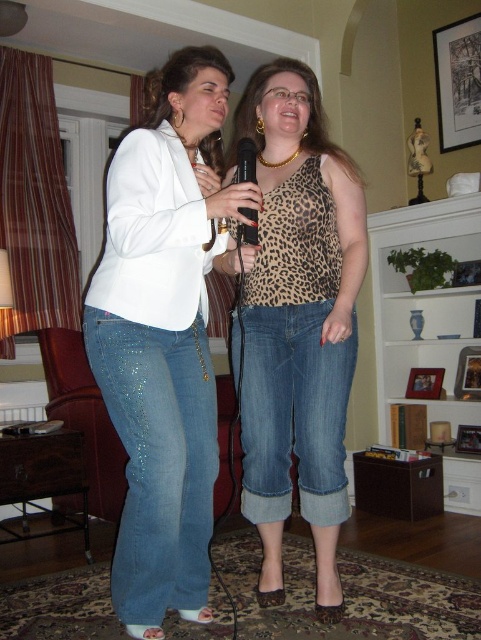
Can you confirm if matte white blazer at center is bigger than black plastic microphone at center?

Yes, matte white blazer at center is bigger than black plastic microphone at center.

This screenshot has height=640, width=481. Identify the location of matte white blazer at center. (164, 336).

This screenshot has height=640, width=481. In order to click on matte white blazer at center in this screenshot , I will do `click(164, 336)`.

Can you confirm if leopard print tank top at center is positioned to the left of black plastic microphone at center?

No, leopard print tank top at center is not to the left of black plastic microphone at center.

Describe the element at coordinates (298, 321) in the screenshot. I see `leopard print tank top at center` at that location.

What do you see at coordinates (298, 321) in the screenshot?
I see `leopard print tank top at center` at bounding box center [298, 321].

I want to click on leopard print tank top at center, so click(298, 321).

Can you confirm if matte white blazer at center is wider than leopard print tank top at center?

Incorrect, matte white blazer at center's width does not surpass leopard print tank top at center's.

Is matte white blazer at center further to camera compared to leopard print tank top at center?

No.

What are the coordinates of `matte white blazer at center` in the screenshot? It's located at (164, 336).

The image size is (481, 640). In order to click on matte white blazer at center in this screenshot , I will do `click(164, 336)`.